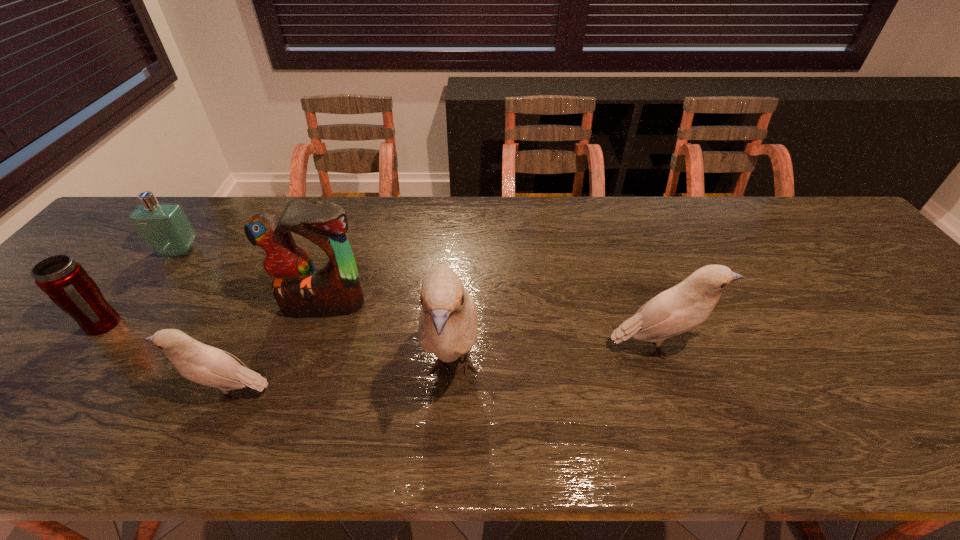
Locate an element on the screen. vacant space at the far left corner is located at coordinates (120, 234).

You are a GUI agent. You are given a task and a screenshot of the screen. Output one action in this format:
    pyautogui.click(x=<x>, y=<y>)
    Task: Click on the free space between the second tallest bird and the shortest bird
    
    Given the screenshot: What is the action you would take?
    pyautogui.click(x=444, y=369)

You are a GUI agent. You are given a task and a screenshot of the screen. Output one action in this format:
    pyautogui.click(x=<x>, y=<y>)
    Task: Click on the free space between the second bird from right to left and the leftmost bird
    
    Given the screenshot: What is the action you would take?
    341,381

Identify the location of free spot between the thermos bottle and the third tallest object. (380, 336).

In order to click on vacant area that lies between the perfume and the third tallest object in this screenshot , I will do `click(418, 299)`.

This screenshot has width=960, height=540. Identify the location of vacant region between the shortest bird and the perfume. (204, 322).

In order to click on free space that is in between the thermos bottle and the perfume in this screenshot , I will do `click(141, 288)`.

Locate an element on the screen. free spot between the fourth shortest object and the farthest object is located at coordinates (418, 299).

Find the location of a particular element. free point between the shortest bird and the parrot is located at coordinates (276, 349).

In order to click on vacant area that lies between the thermos bottle and the farthest object in this screenshot , I will do point(141,288).